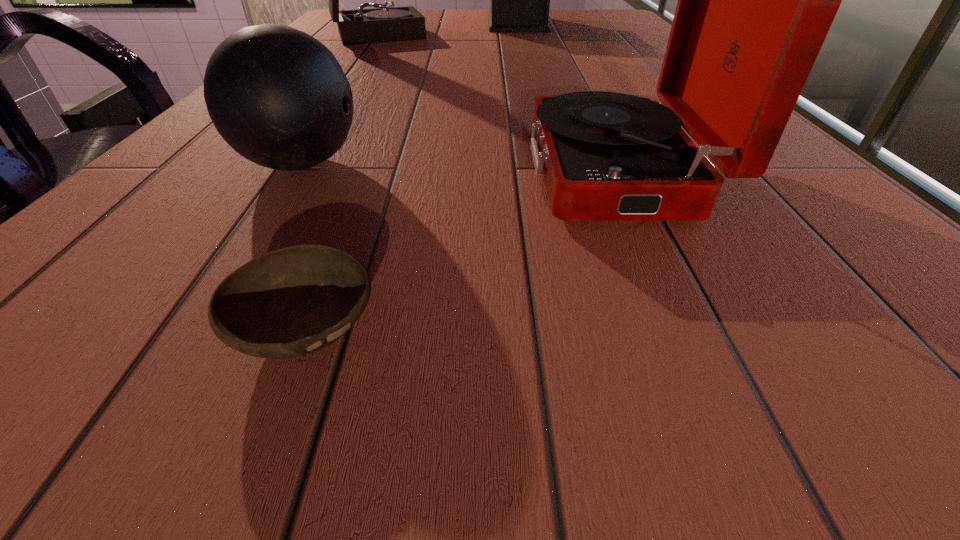
Find the location of a particular element. The height and width of the screenshot is (540, 960). vacant space at the far edge is located at coordinates (440, 12).

You are a GUI agent. You are given a task and a screenshot of the screen. Output one action in this format:
    pyautogui.click(x=<x>, y=<y>)
    Task: Click on the vacant space at the left edge of the desktop
    
    Given the screenshot: What is the action you would take?
    pyautogui.click(x=352, y=47)

In the image, there is a desktop. At what (x,y) coordinates should I click in order to perform the action: click on vacant space at the right edge. Please return your answer as a coordinate pair (x, y). The height and width of the screenshot is (540, 960). Looking at the image, I should click on (656, 81).

The width and height of the screenshot is (960, 540). In the image, there is a desktop. In order to click on free space at the near left corner in this screenshot , I will do `click(37, 428)`.

Where is `free space between the nearest phonograph_record and the leftmost phonograph_record`? This screenshot has width=960, height=540. free space between the nearest phonograph_record and the leftmost phonograph_record is located at coordinates (497, 103).

Find the location of a particular element. free spot between the bowl and the tallest object is located at coordinates (412, 176).

Identify the location of vacant space that is in between the tallest object and the nearest object. (412, 176).

In order to click on vacant space in between the tallest object and the bowl in this screenshot , I will do pos(412,176).

In order to click on vacant area between the nearest phonograph_record and the leftmost phonograph_record in this screenshot , I will do `click(497, 103)`.

Find the location of a particular element. free space between the bowling ball and the tallest object is located at coordinates click(409, 94).